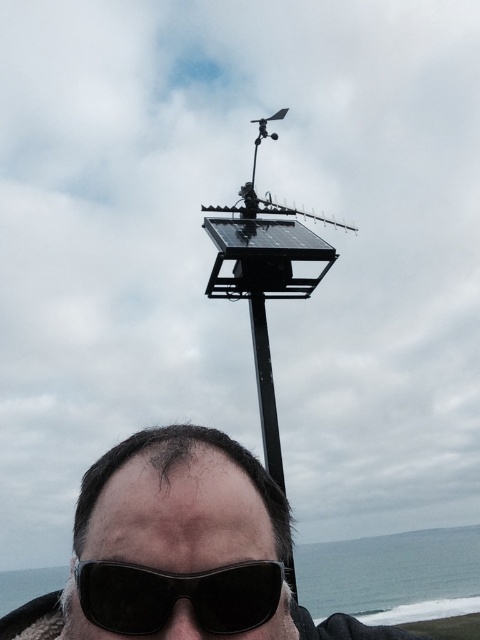
Question: Which point is closer to the camera?

Choices:
 (A) (236, 460)
 (B) (276, 608)

Answer: (B)

Question: Which point appears closest to the camera in this image?

Choices:
 (A) (139, 570)
 (B) (216, 611)

Answer: (B)

Question: Does black matte sunglasses at center have a greater width compared to black matte sunglasses at lower center?

Choices:
 (A) yes
 (B) no

Answer: (A)

Question: Does black matte sunglasses at center appear on the left side of black matte sunglasses at lower center?

Choices:
 (A) yes
 (B) no

Answer: (A)

Question: Is black matte sunglasses at center to the left of black matte sunglasses at lower center from the viewer's perspective?

Choices:
 (A) yes
 (B) no

Answer: (A)

Question: Which object appears closest to the camera in this image?

Choices:
 (A) black matte sunglasses at center
 (B) black matte sunglasses at lower center

Answer: (A)